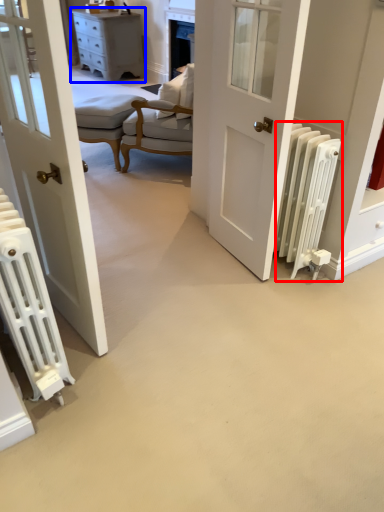
Question: Which point is closer to the camera, radiator (highlighted by a red box) or chest of drawers (highlighted by a blue box)?

Choices:
 (A) radiator
 (B) chest of drawers

Answer: (A)